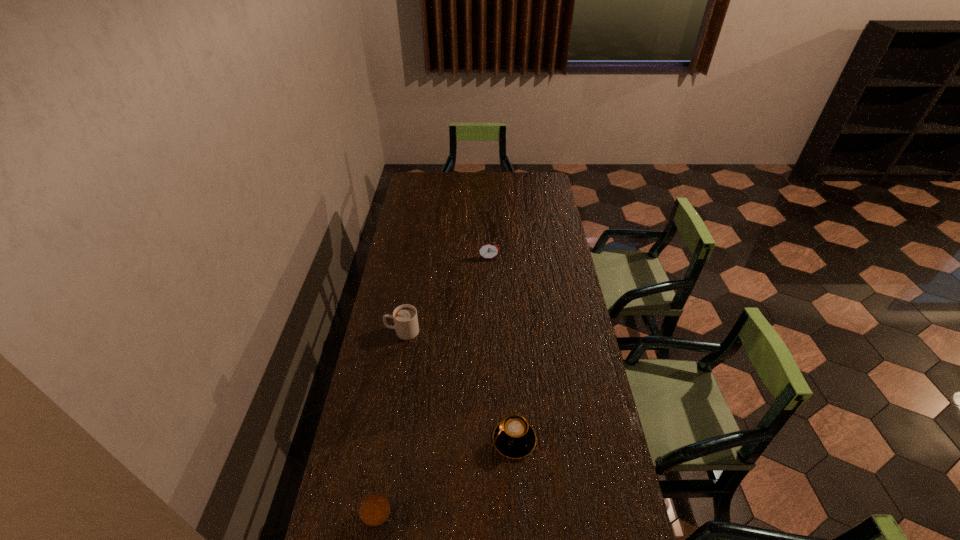
This screenshot has width=960, height=540. In order to click on vacant region that satisfies the following two spatial constraints: 1. on the clock face of the farthest object; 2. on the side with the handle of the tallest cappuccino in this screenshot , I will do `click(491, 332)`.

Where is `vacant area in the image that satisfies the following two spatial constraints: 1. on the side with the handle of the tallest cappuccino; 2. on the right side of the third farthest object`? The width and height of the screenshot is (960, 540). vacant area in the image that satisfies the following two spatial constraints: 1. on the side with the handle of the tallest cappuccino; 2. on the right side of the third farthest object is located at coordinates (384, 440).

The height and width of the screenshot is (540, 960). Identify the location of vacant area in the image that satisfies the following two spatial constraints: 1. on the clock face of the second nearest object; 2. on the right side of the alarm clock. (492, 440).

The width and height of the screenshot is (960, 540). Find the location of `free space that satisfies the following two spatial constraints: 1. on the clock face of the alarm clock; 2. on the side with the handle of the farthest cappuccino`. free space that satisfies the following two spatial constraints: 1. on the clock face of the alarm clock; 2. on the side with the handle of the farthest cappuccino is located at coordinates (491, 332).

Image resolution: width=960 pixels, height=540 pixels. In order to click on vacant space that satisfies the following two spatial constraints: 1. on the clock face of the second nearest object; 2. on the left side of the alarm clock in this screenshot , I will do `click(492, 440)`.

Find the location of a particular element. vacant position in the image that satisfies the following two spatial constraints: 1. on the side with the handle of the second farthest object; 2. on the back side of the second nearest object is located at coordinates (384, 440).